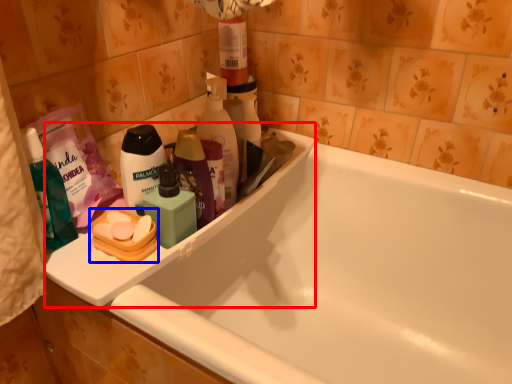
Question: Which of the following is the closest to the observer, sink (highlighted by a red box) or personal care (highlighted by a blue box)?

Choices:
 (A) sink
 (B) personal care

Answer: (A)